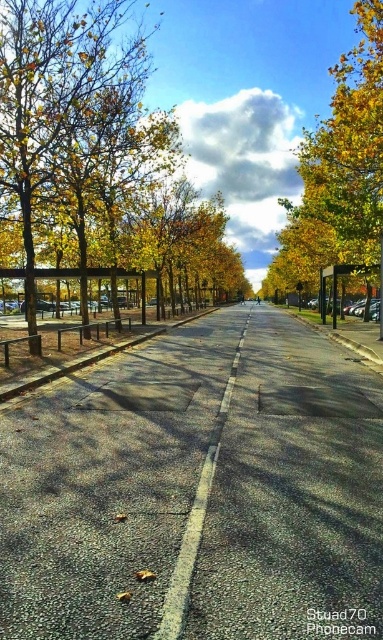
Question: Is white asphalt road at center bigger than metallic bus stop at center-right?

Choices:
 (A) yes
 (B) no

Answer: (B)

Question: Among these objects, which one is nearest to the camera?

Choices:
 (A) metallic bus stop at center-right
 (B) yellow leafy tree at center
 (C) white asphalt road at center

Answer: (C)

Question: Which of these objects is positioned farthest from the yellow leafy tree at center?

Choices:
 (A) metallic bus stop at center-right
 (B) yellow/golden leaves at upper right

Answer: (A)

Question: Which of the following is the farthest from the observer?

Choices:
 (A) pyautogui.click(x=142, y=152)
 (B) pyautogui.click(x=320, y=269)
 (C) pyautogui.click(x=353, y=253)

Answer: (B)

Question: Does yellow leafy tree at center come behind yellow/golden leaves at upper right?

Choices:
 (A) no
 (B) yes

Answer: (A)

Question: Is yellow leafy tree at center positioned at the back of metallic bus stop at center-right?

Choices:
 (A) yes
 (B) no

Answer: (B)